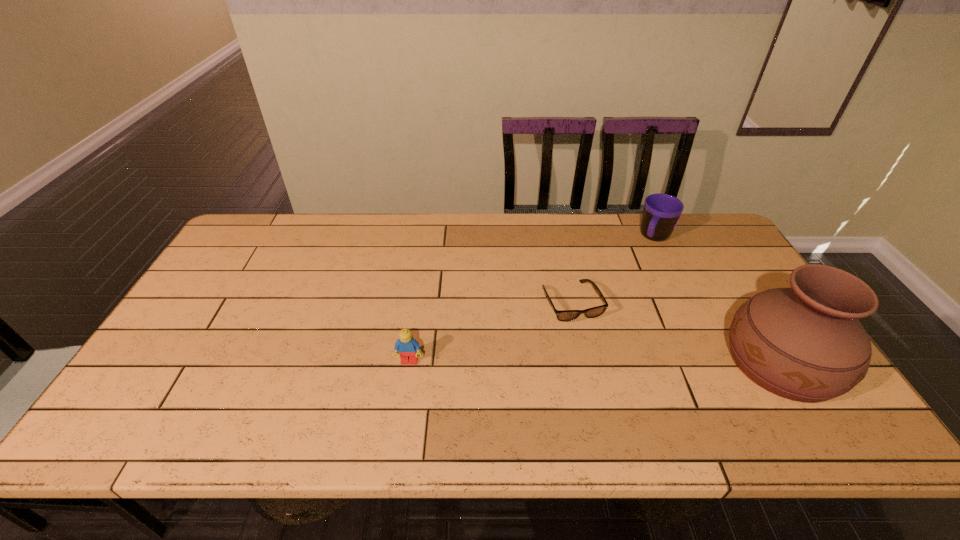
Identify which object is the nearest to the mug. Please provide its 2D coordinates. Your answer should be formatted as a tuple, i.e. [(x, y)], where the tuple contains the x and y coordinates of a point satisfying the conditions above.

[(562, 315)]

Locate an element on the screen. object that is the third closest to the farthest object is located at coordinates (408, 348).

What are the coordinates of `vacant area in the image that satisfies the following two spatial constraints: 1. on the front side of the tallest object; 2. on the right side of the second object from left to right` in the screenshot? It's located at (585, 363).

Where is `vacant space that satisfies the following two spatial constraints: 1. on the front side of the urn; 2. on the right side of the third object from right to left`? Image resolution: width=960 pixels, height=540 pixels. vacant space that satisfies the following two spatial constraints: 1. on the front side of the urn; 2. on the right side of the third object from right to left is located at coordinates (585, 363).

You are a GUI agent. You are given a task and a screenshot of the screen. Output one action in this format:
    pyautogui.click(x=<x>, y=<y>)
    Task: Click on the free location that satisfies the following two spatial constraints: 1. on the back side of the mug; 2. on the left side of the shortest object
    The width and height of the screenshot is (960, 540).
    Given the screenshot: What is the action you would take?
    pyautogui.click(x=558, y=238)